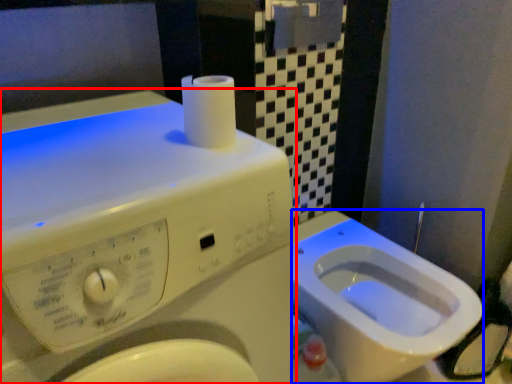
Question: Which object appears farthest to the camera in this image, washing machine (highlighted by a red box) or bidet (highlighted by a blue box)?

Choices:
 (A) washing machine
 (B) bidet

Answer: (B)